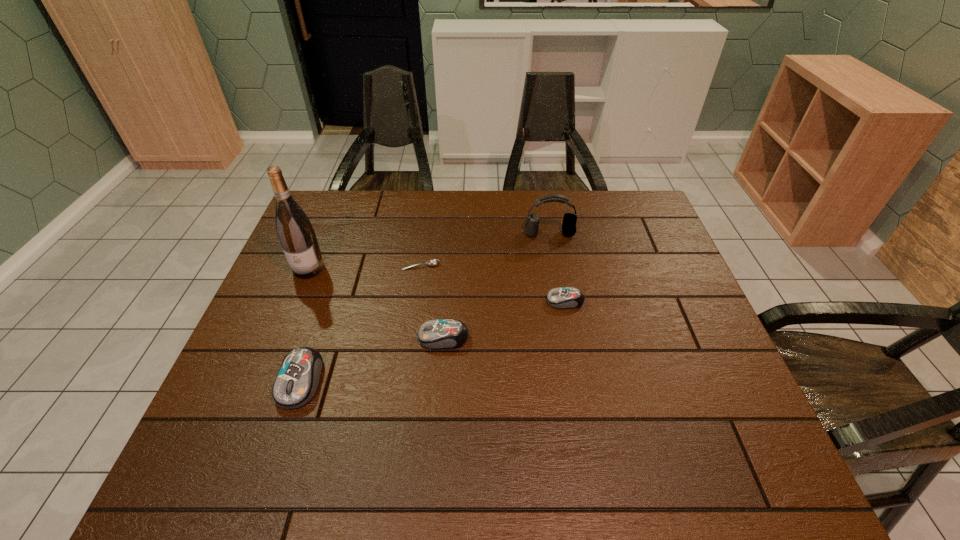
The height and width of the screenshot is (540, 960). What are the coordinates of `vacant space located 0.280m on the wheel side of the second computer mouse from left to right` in the screenshot? It's located at (305, 338).

You are a GUI agent. You are given a task and a screenshot of the screen. Output one action in this format:
    pyautogui.click(x=<x>, y=<y>)
    Task: Click on the vacant space located 0.060m on the wheel side of the second computer mouse from left to right
    
    Given the screenshot: What is the action you would take?
    pyautogui.click(x=394, y=338)

At what (x,y) coordinates should I click in order to perform the action: click on vacant space situated on the wheel side of the second computer mouse from left to right. Please return your answer as a coordinate pair (x, y). This screenshot has height=540, width=960. Looking at the image, I should click on (297, 338).

Locate an element on the screen. The height and width of the screenshot is (540, 960). vacant space located 0.170m on the wheel side of the farthest computer mouse is located at coordinates (483, 301).

I want to click on free space located on the wheel side of the farthest computer mouse, so click(x=412, y=301).

Image resolution: width=960 pixels, height=540 pixels. I want to click on vacant space located 0.150m on the wheel side of the farthest computer mouse, so click(491, 301).

You are a GUI agent. You are given a task and a screenshot of the screen. Output one action in this format:
    pyautogui.click(x=<x>, y=<y>)
    Task: Click on the free space located on the label of the tallest object
    This screenshot has height=540, width=960.
    Given the screenshot: What is the action you would take?
    pyautogui.click(x=254, y=401)

Find the location of a particular element. free space located 0.330m on the left of the soupspoon is located at coordinates (288, 266).

You are a GUI agent. You are given a task and a screenshot of the screen. Output one action in this format:
    pyautogui.click(x=<x>, y=<y>)
    Task: Click on the free space located 0.390m on the headband of the farthest object
    This screenshot has height=540, width=960.
    Given the screenshot: What is the action you would take?
    pyautogui.click(x=568, y=338)

Where is `object located at the far edge`? The width and height of the screenshot is (960, 540). object located at the far edge is located at coordinates [569, 220].